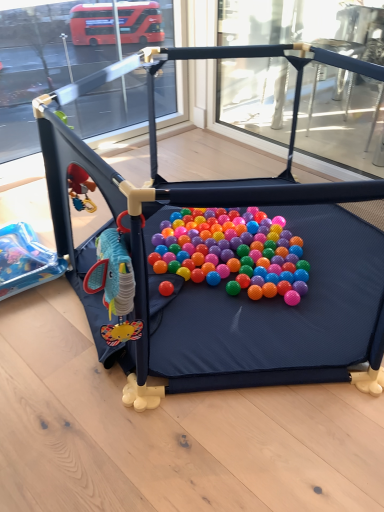
Question: From the image's perspective, relative to rubberized plastic ball pit at center, which ranks as the 1th toy in right-to-left order, is plastic blue toy at left, placed as the 2th toy when sorted from right to left, above or below?

Choices:
 (A) above
 (B) below

Answer: (B)

Question: From a real-world perspective, is plastic blue toy at left, which appears as the first toy when viewed from the left, positioned above or below rubberized plastic ball pit at center, arranged as the 2th toy when viewed from the left?

Choices:
 (A) below
 (B) above

Answer: (A)

Question: In terms of width, does plastic blue toy at left, which appears as the first toy when viewed from the left, look wider or thinner when compared to rubberized plastic ball pit at center, arranged as the 2th toy when viewed from the left?

Choices:
 (A) wide
 (B) thin

Answer: (B)

Question: Is rubberized plastic ball pit at center, arranged as the 2th toy when viewed from the left, to the left or to the right of plastic blue toy at left, which appears as the first toy when viewed from the left, in the image?

Choices:
 (A) left
 (B) right

Answer: (B)

Question: Is rubberized plastic ball pit at center, which ranks as the 1th toy in right-to-left order, bigger or smaller than plastic blue toy at left, which appears as the first toy when viewed from the left?

Choices:
 (A) big
 (B) small

Answer: (A)

Question: In terms of width, does rubberized plastic ball pit at center, which ranks as the 1th toy in right-to-left order, look wider or thinner when compared to plastic blue toy at left, which appears as the first toy when viewed from the left?

Choices:
 (A) thin
 (B) wide

Answer: (B)

Question: Is point pos(198,294) closer or farther from the camera than point pos(39,282)?

Choices:
 (A) closer
 (B) farther

Answer: (A)